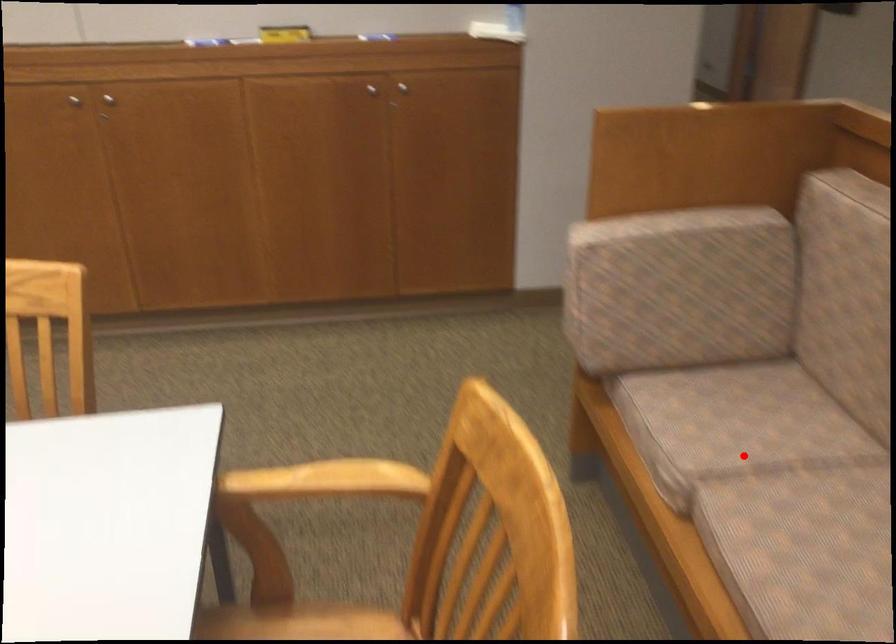
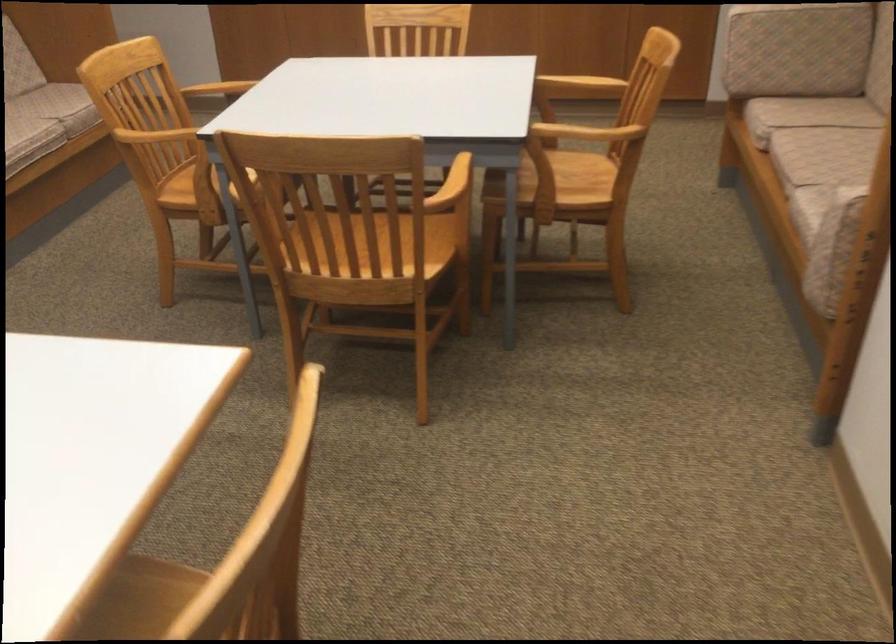
Question: A red point is marked in image1. In image2, is the corresponding 3D point closer to the camera or farther? Reply with the corresponding letter.

Choices:
 (A) The corresponding 3D point is closer.
 (B) The corresponding 3D point is farther.

Answer: (B)